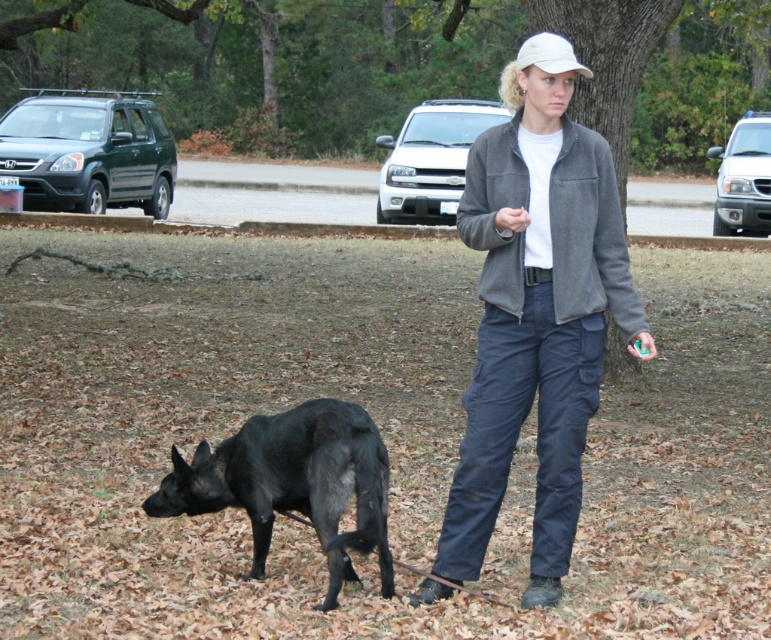
Question: Which of these objects is positioned closest to the white matte baseball cap at upper center?

Choices:
 (A) black matte dog at lower left
 (B) gray fleece jacket at center

Answer: (B)

Question: Is gray fleece jacket at center to the left of white matte baseball cap at upper center from the viewer's perspective?

Choices:
 (A) no
 (B) yes

Answer: (B)

Question: Considering the real-world distances, which object is farthest from the black matte dog at lower left?

Choices:
 (A) white matte baseball cap at upper center
 (B) gray fleece jacket at center

Answer: (A)

Question: Is the position of black matte dog at lower left less distant than that of white matte baseball cap at upper center?

Choices:
 (A) yes
 (B) no

Answer: (A)

Question: Which point is farther to the camera?

Choices:
 (A) gray fleece jacket at center
 (B) white matte baseball cap at upper center
 (C) black matte dog at lower left

Answer: (B)

Question: Is black matte dog at lower left further to the viewer compared to white matte baseball cap at upper center?

Choices:
 (A) yes
 (B) no

Answer: (B)